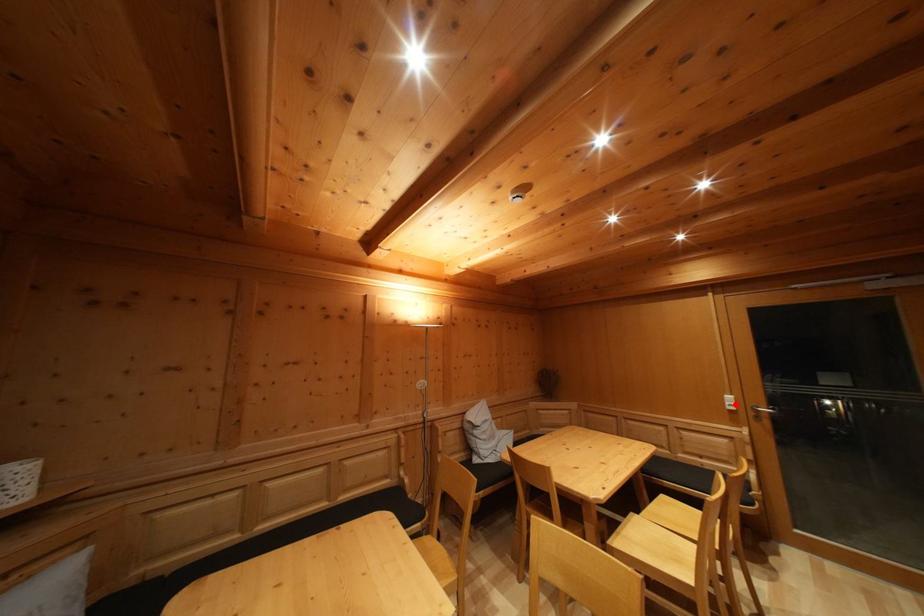
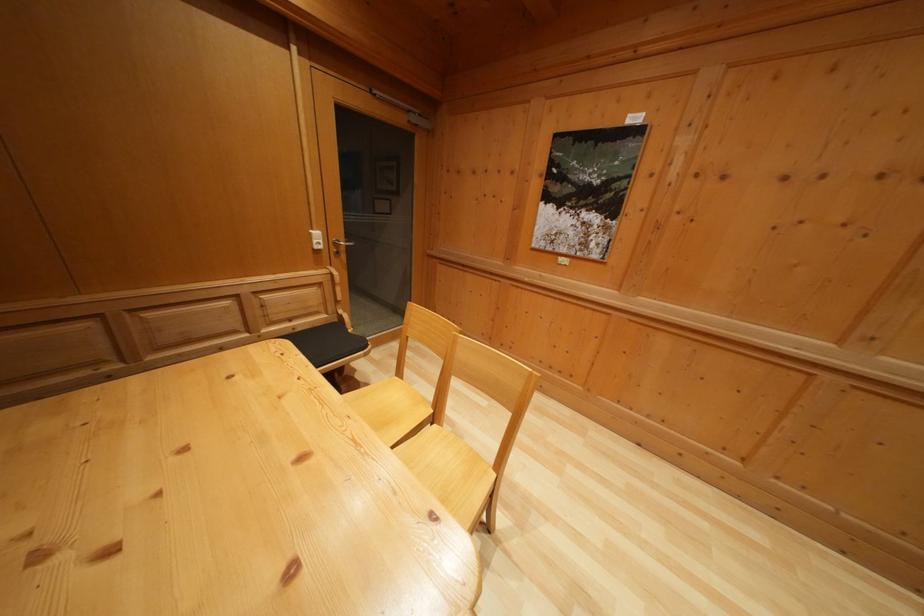
Question: I am providing you with two images of the same scene from different viewpoints. Image1 has a red point marked. In image2, the corresponding 3D location appears at what relative position? Reply with the corresponding letter.

Choices:
 (A) Closer
 (B) Farther

Answer: (A)